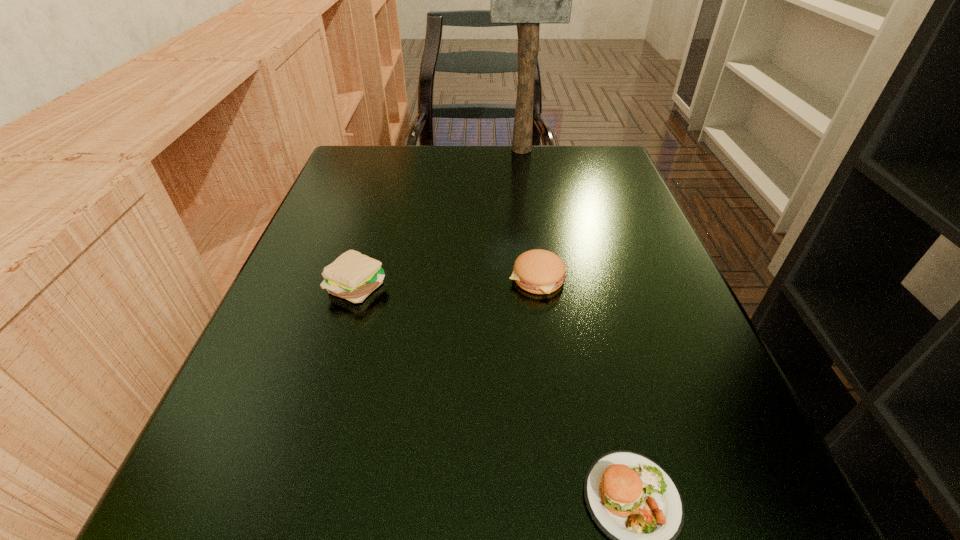
The image size is (960, 540). What are the coordinates of `the second closest object to the third shortest object` in the screenshot? It's located at (633, 500).

At what (x,y) coordinates should I click in order to perform the action: click on patty that can be found as the closest to the nearest object. Please return your answer as a coordinate pair (x, y). The image size is (960, 540). Looking at the image, I should click on (538, 271).

Point out which patty is positioned as the third nearest to the tallest object. Please provide its 2D coordinates. Your answer should be formatted as a tuple, i.e. [(x, y)], where the tuple contains the x and y coordinates of a point satisfying the conditions above.

[(633, 500)]